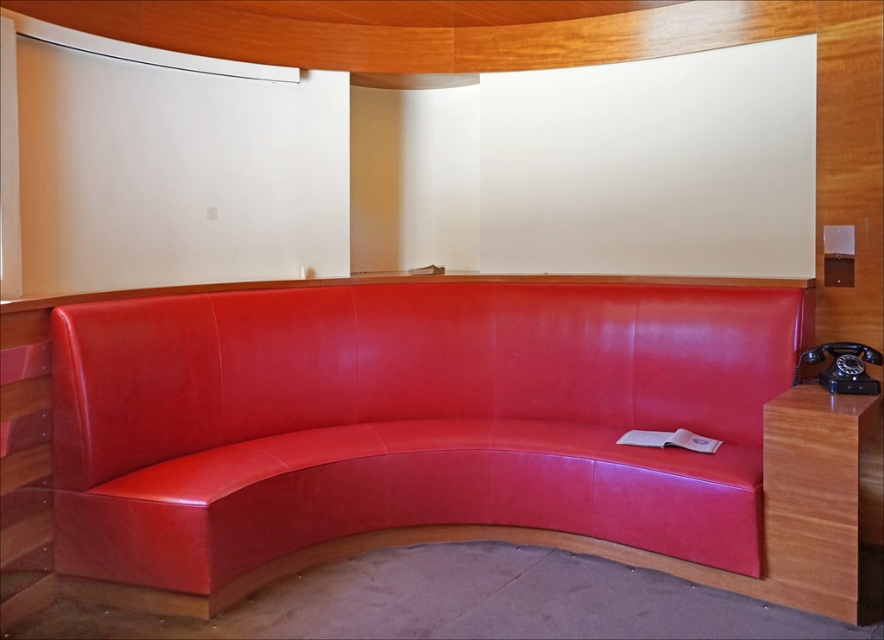
Which of these two, matte leather couch at center or black rubberized phone at right, stands shorter?

Standing shorter between the two is black rubberized phone at right.

Can you confirm if matte leather couch at center is positioned below black rubberized phone at right?

Yes.

This screenshot has width=884, height=640. In order to click on matte leather couch at center in this screenshot , I will do `click(408, 420)`.